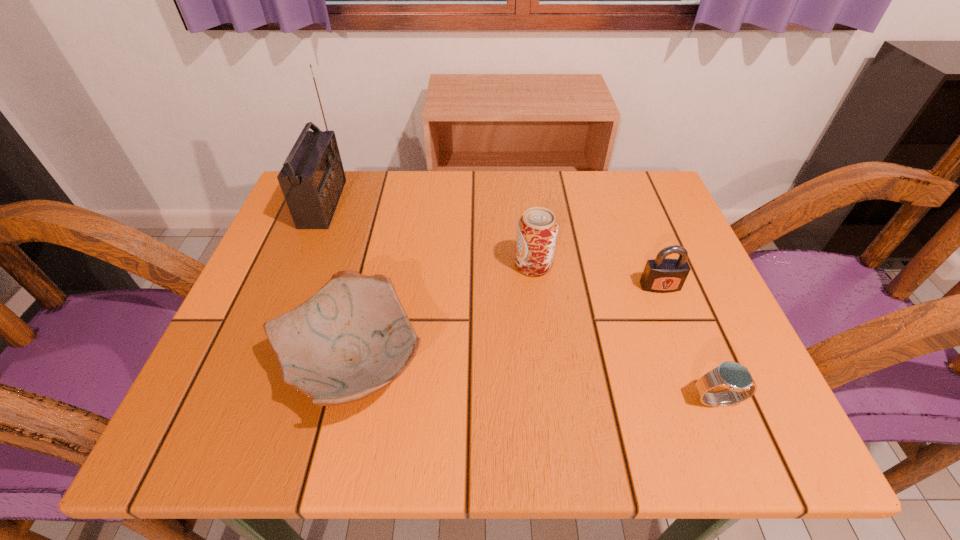
Identify the location of vacant area that lies between the third farthest object and the pottery. The image size is (960, 540). (506, 325).

At what (x,y) coordinates should I click in order to perform the action: click on empty location between the third object from left to right and the tallest object. Please return your answer as a coordinate pair (x, y). The width and height of the screenshot is (960, 540). Looking at the image, I should click on (428, 234).

Image resolution: width=960 pixels, height=540 pixels. Identify the location of free space between the fourth shortest object and the pottery. (443, 314).

Where is `free space between the pottery and the shortest object`? The width and height of the screenshot is (960, 540). free space between the pottery and the shortest object is located at coordinates (535, 382).

Identify the location of blank region between the shortest object and the pottery. (535, 382).

At what (x,y) coordinates should I click in order to perform the action: click on free space between the pottery and the watch. Please return your answer as a coordinate pair (x, y). Looking at the image, I should click on (535, 382).

This screenshot has height=540, width=960. I want to click on empty space that is in between the pottery and the shortest object, so click(x=535, y=382).

Identify which object is located as the nearest to the farthest object. Please provide its 2D coordinates. Your answer should be formatted as a tuple, i.e. [(x, y)], where the tuple contains the x and y coordinates of a point satisfying the conditions above.

[(352, 338)]

Locate which object is the third closest to the pottery. Please provide its 2D coordinates. Your answer should be formatted as a tuple, i.e. [(x, y)], where the tuple contains the x and y coordinates of a point satisfying the conditions above.

[(661, 275)]

The image size is (960, 540). Find the location of `free point that satisfies the following two spatial constraints: 1. on the back side of the pottery; 2. on the front panel of the radio receiver`. free point that satisfies the following two spatial constraints: 1. on the back side of the pottery; 2. on the front panel of the radio receiver is located at coordinates tap(390, 204).